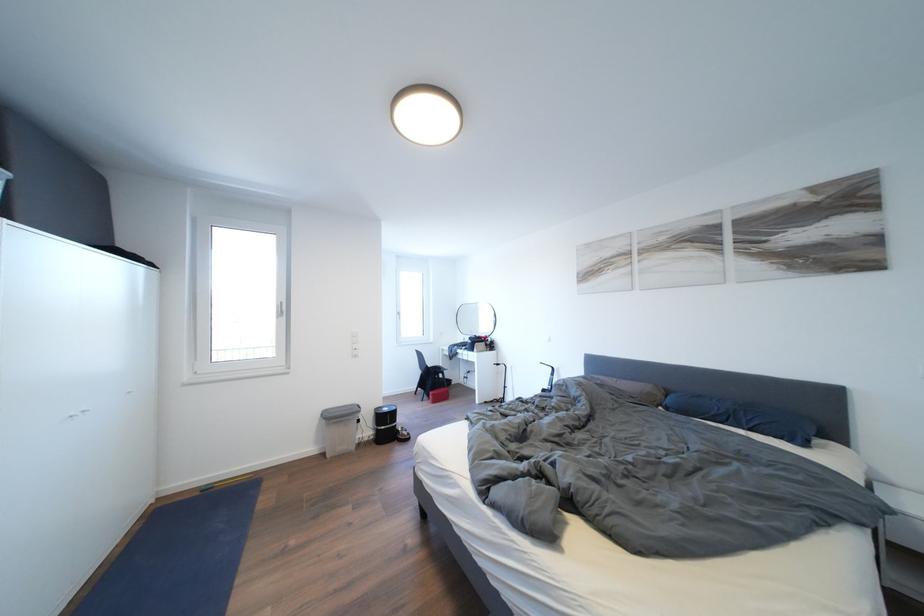
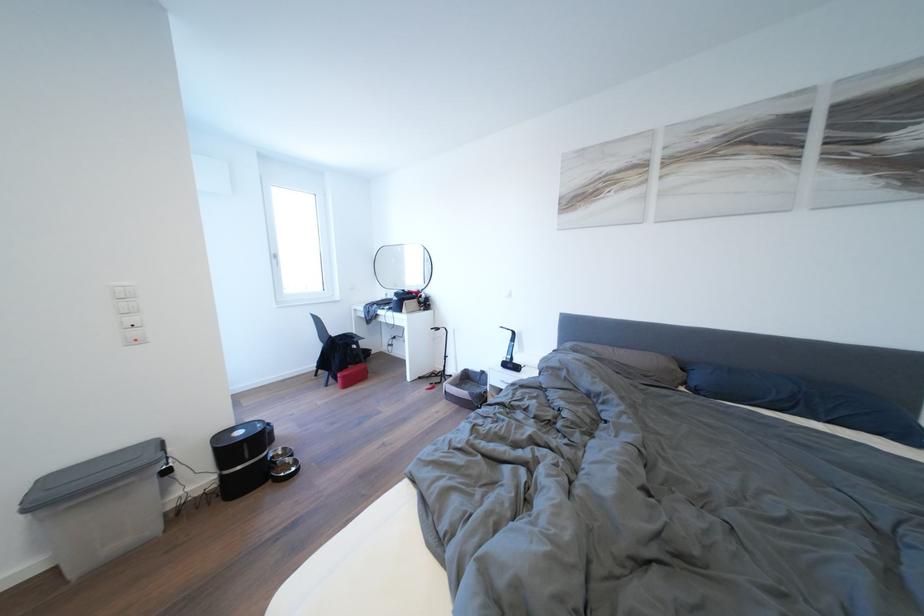
The point at (394, 414) is marked in the first image. Where is the corresponding point in the second image?

(248, 438)